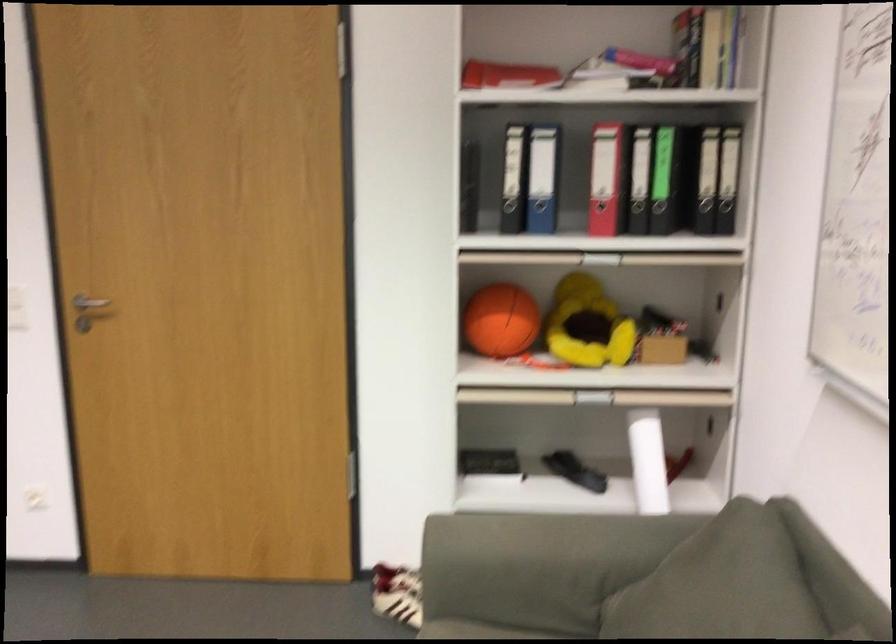
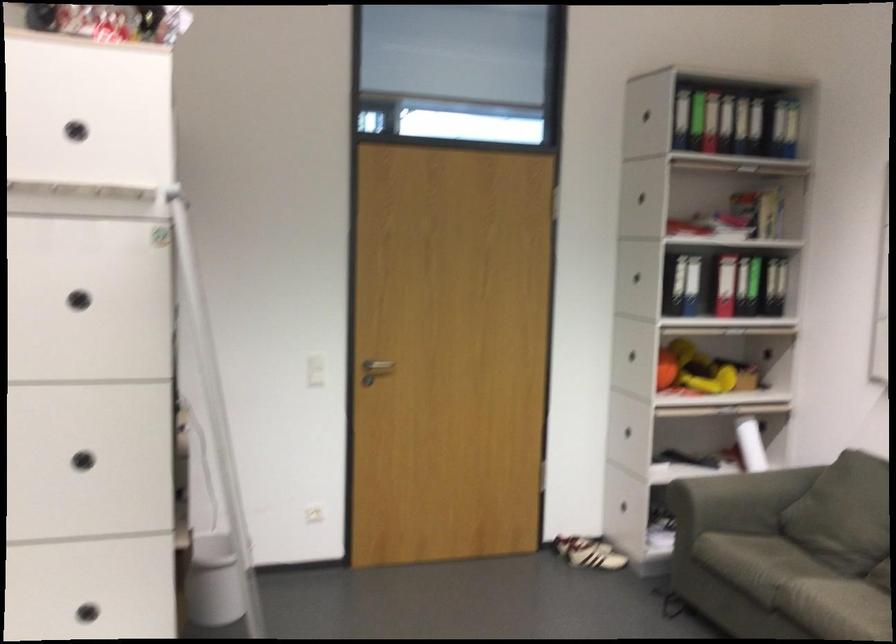
Find the pixel in the second image that matches point 643,196 in the first image.

(757, 285)